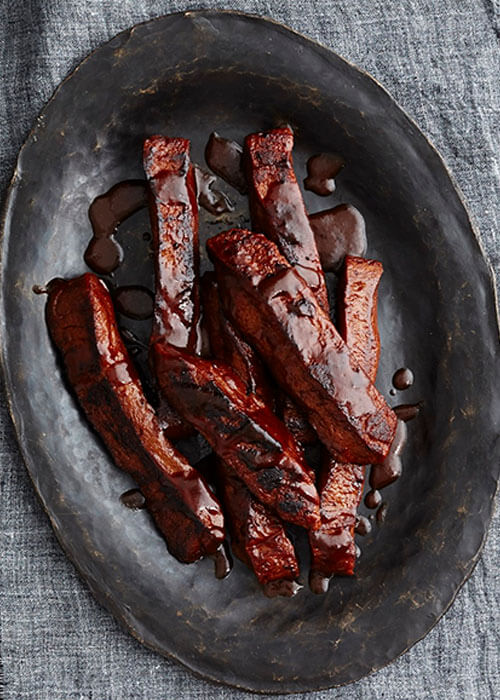
In order to click on rustic plate in this screenshot , I will do click(422, 586).